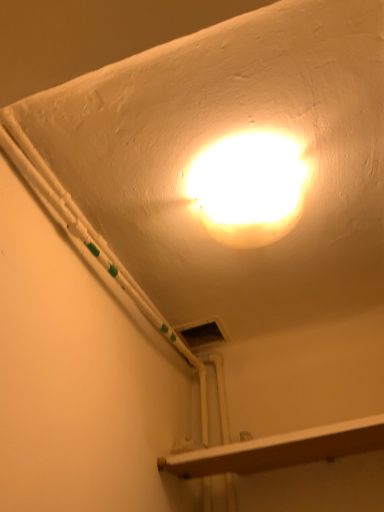
Find the location of a particular element. This screenshot has width=384, height=512. wooden at lower right is located at coordinates (279, 450).

What do you see at coordinates (279, 450) in the screenshot? This screenshot has width=384, height=512. I see `wooden at lower right` at bounding box center [279, 450].

What do you see at coordinates (249, 188) in the screenshot? I see `white glossy light fixture at upper center` at bounding box center [249, 188].

What is the approximate width of white glossy light fixture at upper center?

It is 11.38 inches.

Identify the location of white glossy light fixture at upper center. This screenshot has height=512, width=384. (249, 188).

The height and width of the screenshot is (512, 384). I want to click on wooden at lower right, so click(279, 450).

Considering the relative positions of wooden at lower right and white glossy light fixture at upper center in the image provided, is wooden at lower right to the left of white glossy light fixture at upper center from the viewer's perspective?

In fact, wooden at lower right is to the right of white glossy light fixture at upper center.

Which object is further away from the camera, wooden at lower right or white glossy light fixture at upper center?

Positioned behind is wooden at lower right.

Is point (232, 447) in front of point (285, 170)?

No, (232, 447) is further to viewer.

From the image's perspective, relative to white glossy light fixture at upper center, is wooden at lower right above or below?

From the image's perspective, wooden at lower right appears below white glossy light fixture at upper center.

From a real-world perspective, which is physically above, wooden at lower right or white glossy light fixture at upper center?

white glossy light fixture at upper center.

Which of these two, wooden at lower right or white glossy light fixture at upper center, is wider?

wooden at lower right.

Can you confirm if wooden at lower right is shorter than white glossy light fixture at upper center?

Indeed, wooden at lower right has a lesser height compared to white glossy light fixture at upper center.

Is wooden at lower right smaller than white glossy light fixture at upper center?

No.

Is wooden at lower right outside of white glossy light fixture at upper center?

Absolutely, wooden at lower right is external to white glossy light fixture at upper center.

Is there a large distance between wooden at lower right and white glossy light fixture at upper center?

That's not correct — wooden at lower right is a little close to white glossy light fixture at upper center.

Is wooden at lower right looking in the opposite direction of white glossy light fixture at upper center?

No.

How many degrees apart are the facing directions of wooden at lower right and white glossy light fixture at upper center?

The angular difference between wooden at lower right and white glossy light fixture at upper center is 1.46 degrees.

Where is `lamp that appears in front of the wooden at lower right`? The width and height of the screenshot is (384, 512). lamp that appears in front of the wooden at lower right is located at coordinates (249, 188).

Does white glossy light fixture at upper center appear on the right side of wooden at lower right?

No, white glossy light fixture at upper center is not to the right of wooden at lower right.

Who is more distant, white glossy light fixture at upper center or wooden at lower right?

Positioned behind is wooden at lower right.

Is point (212, 196) closer to camera compared to point (169, 467)?

Yes.

From the image's perspective, is white glossy light fixture at upper center over wooden at lower right?

Correct, white glossy light fixture at upper center appears higher than wooden at lower right in the image.

In the scene shown: From a real-world perspective, is white glossy light fixture at upper center physically below wooden at lower right?

No, from a real-world perspective, white glossy light fixture at upper center is not under wooden at lower right.

Is white glossy light fixture at upper center thinner than wooden at lower right?

Correct, the width of white glossy light fixture at upper center is less than that of wooden at lower right.

Considering the relative sizes of white glossy light fixture at upper center and wooden at lower right in the image provided, is white glossy light fixture at upper center taller than wooden at lower right?

Correct, white glossy light fixture at upper center is much taller as wooden at lower right.

Can you confirm if white glossy light fixture at upper center is smaller than wooden at lower right?

Yes.

Is white glossy light fixture at upper center inside or outside of wooden at lower right?

white glossy light fixture at upper center lies outside wooden at lower right.

Is white glossy light fixture at upper center touching wooden at lower right?

No.

Is white glossy light fixture at upper center oriented away from wooden at lower right?

No, white glossy light fixture at upper center is not facing the opposite direction of wooden at lower right.

I want to click on lamp located in front of the wooden at lower right, so click(249, 188).

At what (x,y) coordinates should I click in order to perform the action: click on lamp that is above the wooden at lower right (from a real-world perspective). Please return your answer as a coordinate pair (x, y). Looking at the image, I should click on (249, 188).

Locate an element on the screen. shelf below the white glossy light fixture at upper center (from the image's perspective) is located at coordinates (279, 450).